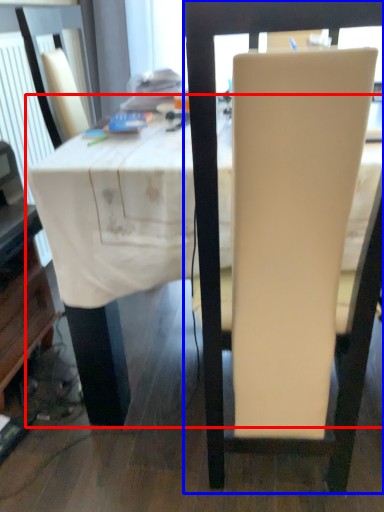
Question: Which point is closer to the camera, table (highlighted by a red box) or chair (highlighted by a blue box)?

Choices:
 (A) table
 (B) chair

Answer: (B)